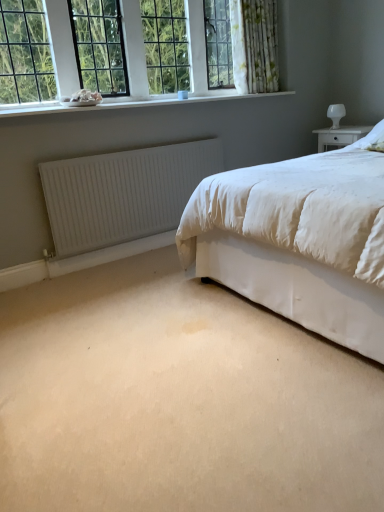
Question: Considering the relative sizes of clear glass window at upper left and white glossy table lamp at upper right in the image provided, is clear glass window at upper left smaller than white glossy table lamp at upper right?

Choices:
 (A) no
 (B) yes

Answer: (A)

Question: Does clear glass window at upper left have a larger size compared to white glossy table lamp at upper right?

Choices:
 (A) no
 (B) yes

Answer: (B)

Question: Is clear glass window at upper left facing away from white glossy table lamp at upper right?

Choices:
 (A) no
 (B) yes

Answer: (A)

Question: Would you say clear glass window at upper left is a long distance from white glossy table lamp at upper right?

Choices:
 (A) no
 (B) yes

Answer: (B)

Question: Can you confirm if clear glass window at upper left is wider than white glossy table lamp at upper right?

Choices:
 (A) no
 (B) yes

Answer: (A)

Question: Could you tell me if clear glass window at upper left is facing white glossy table lamp at upper right?

Choices:
 (A) no
 (B) yes

Answer: (A)

Question: Is white smooth window sill at upper left at the left side of clear glass window at upper left?

Choices:
 (A) yes
 (B) no

Answer: (B)

Question: Can we say white smooth window sill at upper left lies outside clear glass window at upper left?

Choices:
 (A) yes
 (B) no

Answer: (A)

Question: Is the position of white smooth window sill at upper left less distant than that of clear glass window at upper left?

Choices:
 (A) yes
 (B) no

Answer: (A)

Question: Does white smooth window sill at upper left have a smaller size compared to clear glass window at upper left?

Choices:
 (A) no
 (B) yes

Answer: (B)

Question: Is white smooth window sill at upper left bigger than clear glass window at upper left?

Choices:
 (A) no
 (B) yes

Answer: (A)

Question: Is the position of white smooth window sill at upper left more distant than that of clear glass window at upper left?

Choices:
 (A) no
 (B) yes

Answer: (A)

Question: Is clear glass window at upper left at the back of white matte radiator at lower left?

Choices:
 (A) no
 (B) yes

Answer: (A)